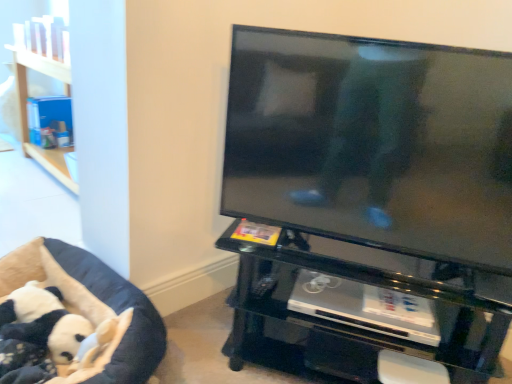
Question: Is black plush panda at lower left smaller than black glossy tv at upper right?

Choices:
 (A) yes
 (B) no

Answer: (A)

Question: Is black plush panda at lower left completely or partially outside of black glossy tv at upper right?

Choices:
 (A) yes
 (B) no

Answer: (A)

Question: Considering the relative sizes of black plush panda at lower left and black glossy tv at upper right in the image provided, is black plush panda at lower left thinner than black glossy tv at upper right?

Choices:
 (A) no
 (B) yes

Answer: (A)

Question: Does black plush panda at lower left come in front of black glossy tv at upper right?

Choices:
 (A) yes
 (B) no

Answer: (B)

Question: Considering the relative positions of black plush panda at lower left and black glossy tv at upper right in the image provided, is black plush panda at lower left behind black glossy tv at upper right?

Choices:
 (A) no
 (B) yes

Answer: (B)

Question: Is black glass tv stand at center, acting as the first furniture starting from the right, inside the boundaries of black glossy tv at upper right, or outside?

Choices:
 (A) inside
 (B) outside

Answer: (B)

Question: Looking at the image, does black glass tv stand at center, acting as the 2th furniture starting from the left, seem bigger or smaller compared to black glossy tv at upper right?

Choices:
 (A) small
 (B) big

Answer: (B)

Question: Is black glass tv stand at center, acting as the 2th furniture starting from the left, wider or thinner than black glossy tv at upper right?

Choices:
 (A) thin
 (B) wide

Answer: (B)

Question: Is black glass tv stand at center, acting as the first furniture starting from the right, in front of or behind black glossy tv at upper right in the image?

Choices:
 (A) front
 (B) behind

Answer: (B)

Question: From the image's perspective, is black glossy tv at upper right positioned above or below black glass tv stand at center, acting as the 2th furniture starting from the left?

Choices:
 (A) above
 (B) below

Answer: (A)

Question: In terms of width, does black glossy tv at upper right look wider or thinner when compared to black glass tv stand at center, acting as the 2th furniture starting from the left?

Choices:
 (A) wide
 (B) thin

Answer: (B)

Question: Is black glossy tv at upper right to the left or to the right of black glass tv stand at center, acting as the 2th furniture starting from the left, in the image?

Choices:
 (A) left
 (B) right

Answer: (A)

Question: From their relative heights in the image, would you say black glossy tv at upper right is taller or shorter than black glass tv stand at center, acting as the 2th furniture starting from the left?

Choices:
 (A) tall
 (B) short

Answer: (A)

Question: Based on their sizes in the image, would you say black glass tv stand at center, acting as the first furniture starting from the right, is bigger or smaller than black plush dog bed at lower left, the second furniture in the right-to-left sequence?

Choices:
 (A) big
 (B) small

Answer: (A)

Question: In the image, is black glass tv stand at center, acting as the first furniture starting from the right, positioned in front of or behind black plush dog bed at lower left, placed as the first furniture when sorted from left to right?

Choices:
 (A) behind
 (B) front

Answer: (A)